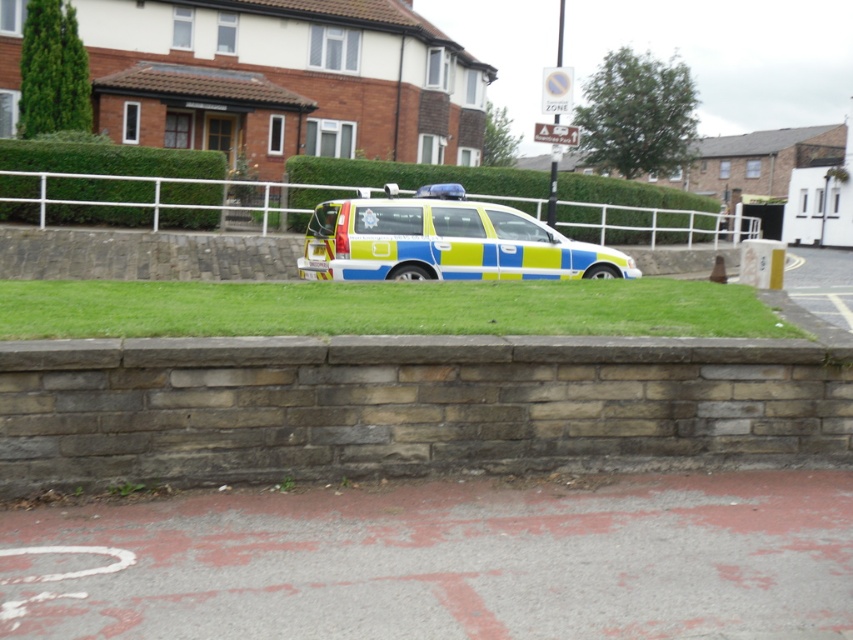
Where is `blue-green metallic van at center`? blue-green metallic van at center is located at coordinates (445, 241).

Does point (491, 234) come closer to viewer compared to point (741, 225)?

Yes, point (491, 234) is in front of point (741, 225).

The height and width of the screenshot is (640, 853). Describe the element at coordinates (445, 241) in the screenshot. I see `blue-green metallic van at center` at that location.

At what (x,y) coordinates should I click in order to perform the action: click on blue-green metallic van at center. Please return your answer as a coordinate pair (x, y). The height and width of the screenshot is (640, 853). Looking at the image, I should click on (445, 241).